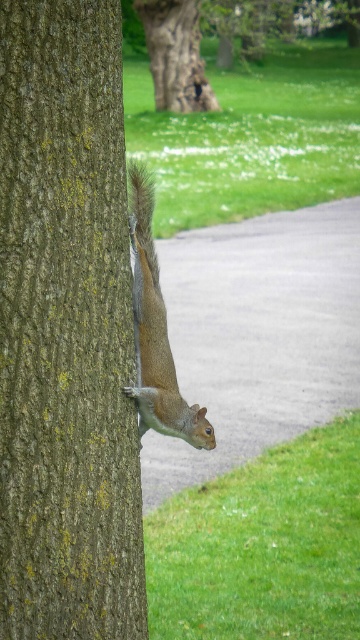
Can you confirm if smooth brown bark at center is wider than fuzzy brown tail at upper right?

No, smooth brown bark at center is not wider than fuzzy brown tail at upper right.

This screenshot has height=640, width=360. What do you see at coordinates (66, 330) in the screenshot? I see `smooth brown bark at center` at bounding box center [66, 330].

Between point (81, 257) and point (141, 244), which one is positioned behind?

Positioned behind is point (141, 244).

The width and height of the screenshot is (360, 640). What are the coordinates of `smooth brown bark at center` in the screenshot? It's located at (66, 330).

Who is more forward, (x=165, y=104) or (x=149, y=52)?

Point (x=165, y=104) is more forward.

The height and width of the screenshot is (640, 360). What do you see at coordinates (176, 54) in the screenshot?
I see `brown rough bark at upper center` at bounding box center [176, 54].

Locate an element on the screen. The height and width of the screenshot is (640, 360). brown rough bark at upper center is located at coordinates (176, 54).

Who is lower down, brown rough bark at upper center or fuzzy brown tail at upper right?

Positioned lower is fuzzy brown tail at upper right.

Consider the image. Can you confirm if brown rough bark at upper center is taller than fuzzy brown tail at upper right?

In fact, brown rough bark at upper center may be shorter than fuzzy brown tail at upper right.

Between point (255, 44) and point (133, 180), which one is positioned behind?

The point (255, 44) is behind.

Where is `brown rough bark at upper center`? The height and width of the screenshot is (640, 360). brown rough bark at upper center is located at coordinates (176, 54).